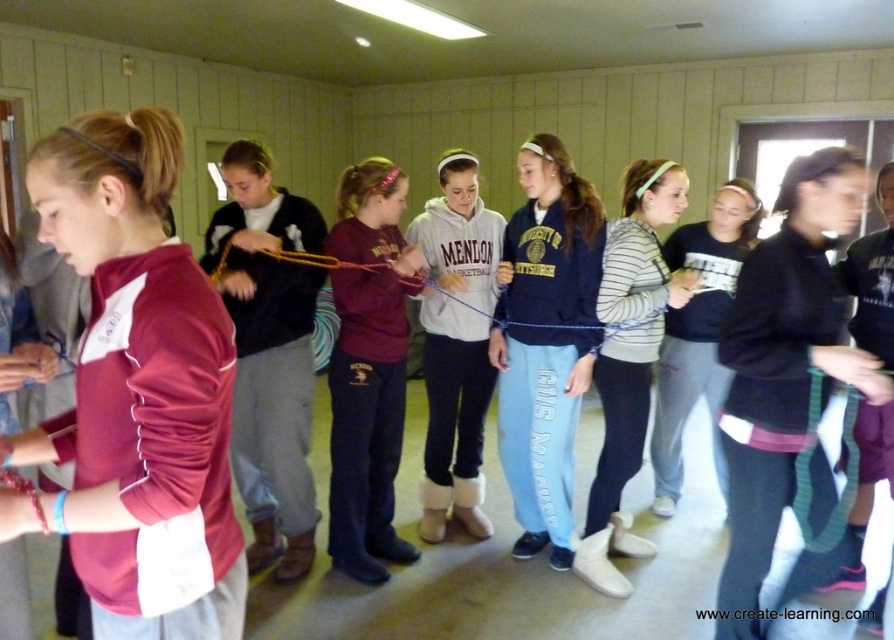
You are standing in the room and want to find the maroon jersey at left. Based on the coordinates given, where should you look relative to the center of the image?

The maroon jersey at left is located at coordinates 0.614 on the x axis and 0.153 on the y axis, which means it is positioned to the right and slightly below the center of the image.